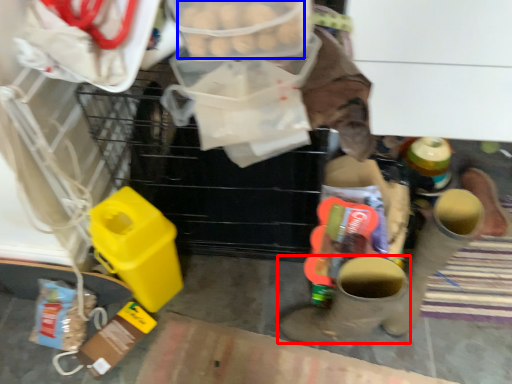
Question: Which object is further to the camera taking this photo, footwear (highlighted by a red box) or food (highlighted by a blue box)?

Choices:
 (A) footwear
 (B) food

Answer: (A)